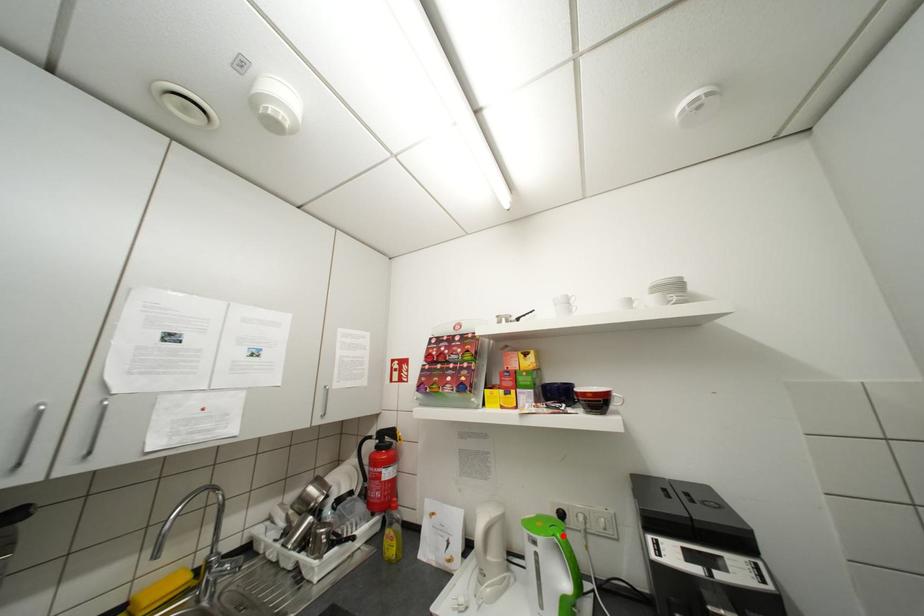
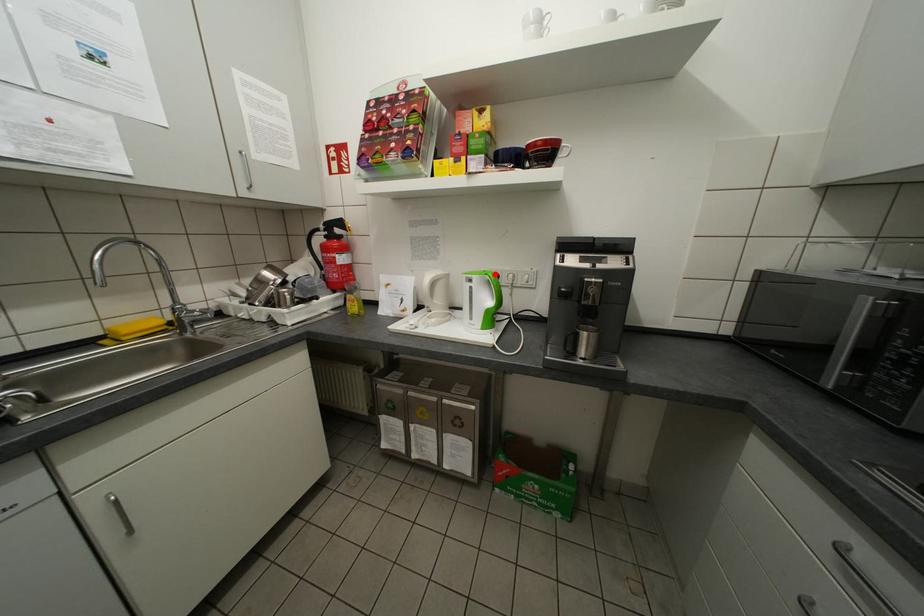
I am providing you with two images of the same scene from different viewpoints. A red point is marked on the first image and another point is marked on the second image. Is the marked point in image1 the same physical position as the marked point in image2?

Yes